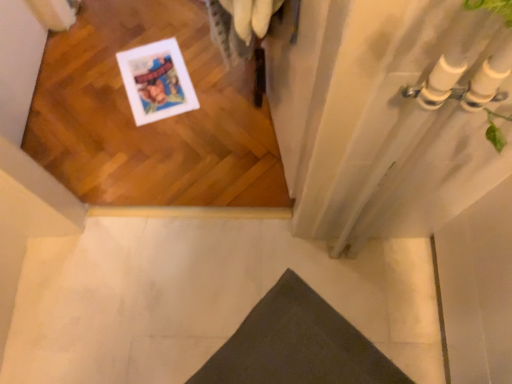
Question: From a real-world perspective, is white tile floor at lower left positioned above or below dark gray fabric doormat at lower center?

Choices:
 (A) above
 (B) below

Answer: (B)

Question: In terms of size, does white tile floor at lower left appear bigger or smaller than dark gray fabric doormat at lower center?

Choices:
 (A) small
 (B) big

Answer: (B)

Question: In the image, is white tile floor at lower left positioned in front of or behind dark gray fabric doormat at lower center?

Choices:
 (A) front
 (B) behind

Answer: (B)

Question: Considering their positions, is dark gray fabric doormat at lower center located in front of or behind white tile floor at lower left?

Choices:
 (A) front
 (B) behind

Answer: (A)

Question: Looking at the image, does dark gray fabric doormat at lower center seem bigger or smaller compared to white tile floor at lower left?

Choices:
 (A) big
 (B) small

Answer: (B)

Question: Considering the positions of dark gray fabric doormat at lower center and white tile floor at lower left in the image, is dark gray fabric doormat at lower center taller or shorter than white tile floor at lower left?

Choices:
 (A) short
 (B) tall

Answer: (A)

Question: Which is correct: dark gray fabric doormat at lower center is inside white tile floor at lower left, or outside of it?

Choices:
 (A) outside
 (B) inside

Answer: (A)